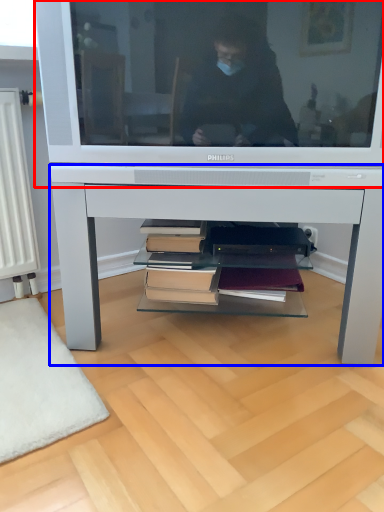
Question: Among these objects, which one is farthest to the camera, television (highlighted by a red box) or desk (highlighted by a blue box)?

Choices:
 (A) television
 (B) desk

Answer: (B)